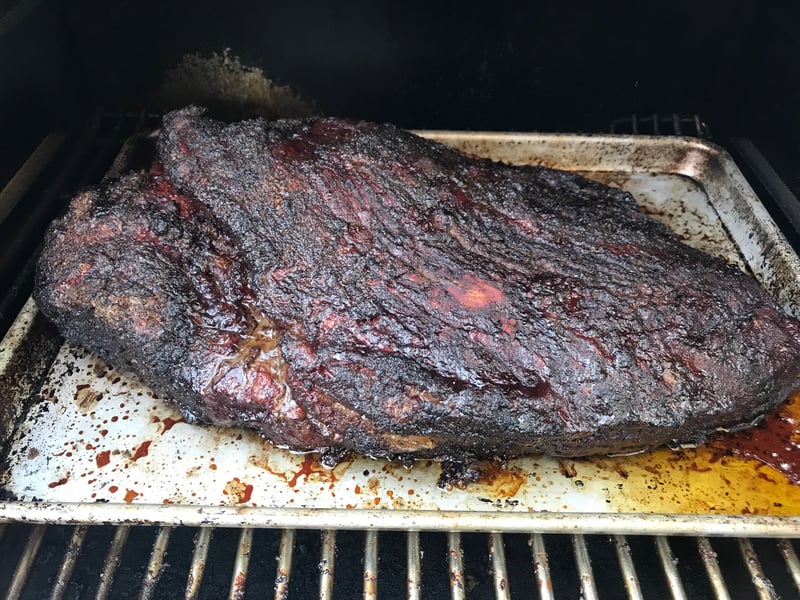
Where is `stain on wall`? The width and height of the screenshot is (800, 600). stain on wall is located at coordinates (232, 83).